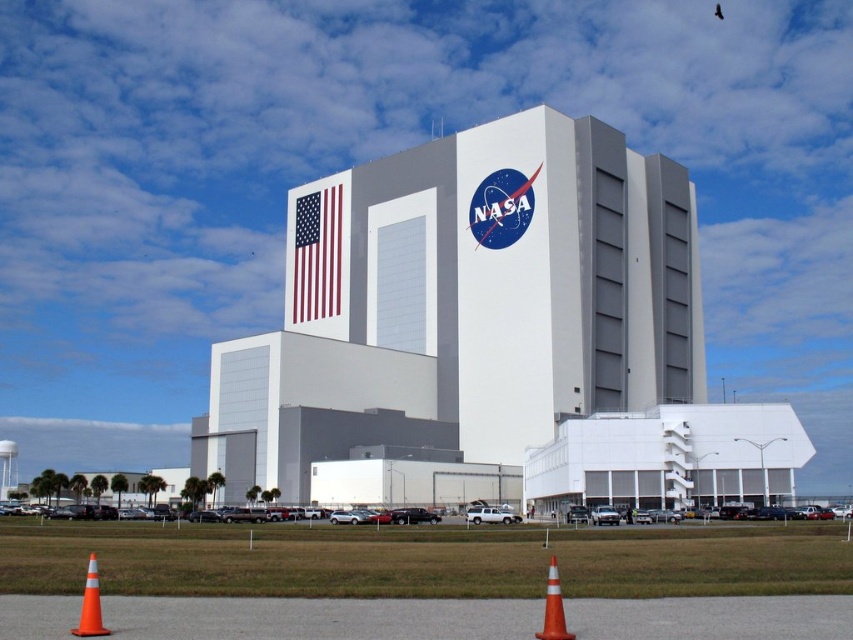
Question: Where is white smooth building at center located in relation to orange plastic traffic cone at lower center in the image?

Choices:
 (A) above
 (B) below

Answer: (A)

Question: Which point is closer to the camera?

Choices:
 (A) orange traffic cone at lower center
 (B) orange reflective cone at lower left
 (C) orange plastic traffic cone at lower center

Answer: (C)

Question: Which point is farther from the camera taking this photo?

Choices:
 (A) (96, 620)
 (B) (425, 448)

Answer: (B)

Question: Which point appears farthest from the camera in this image?

Choices:
 (A) (378, 362)
 (B) (103, 627)
 (C) (309, 212)

Answer: (C)

Question: Is orange reflective cone at lower left bigger than orange plastic traffic cone at lower center?

Choices:
 (A) no
 (B) yes

Answer: (B)

Question: Is red fabric flag at upper center below gray asphalt runway at lower center?

Choices:
 (A) no
 (B) yes

Answer: (A)